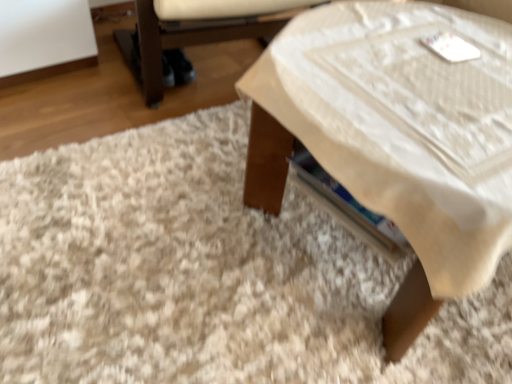
Locate an element on the screen. The height and width of the screenshot is (384, 512). vacant region above wooden table at center (from a real-world perspective) is located at coordinates (417, 94).